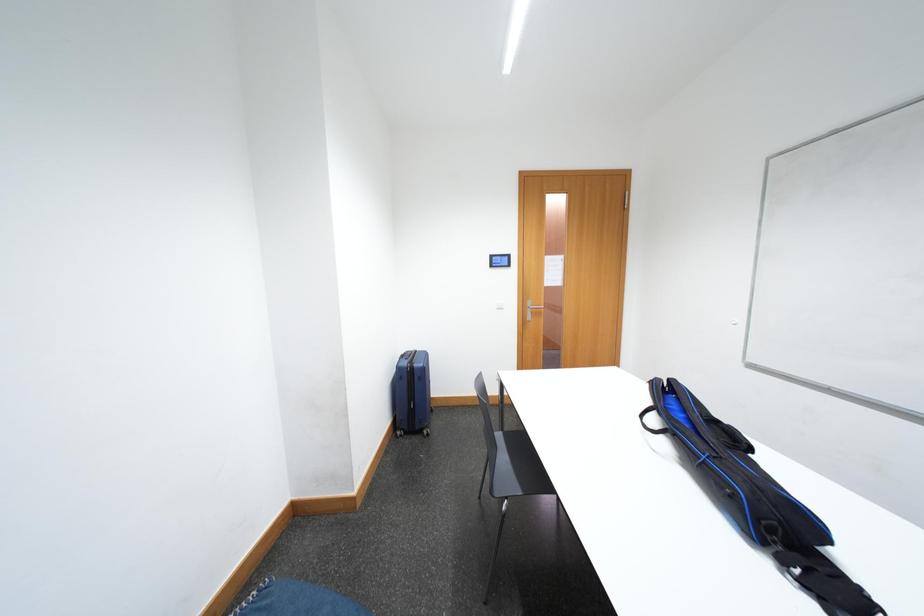
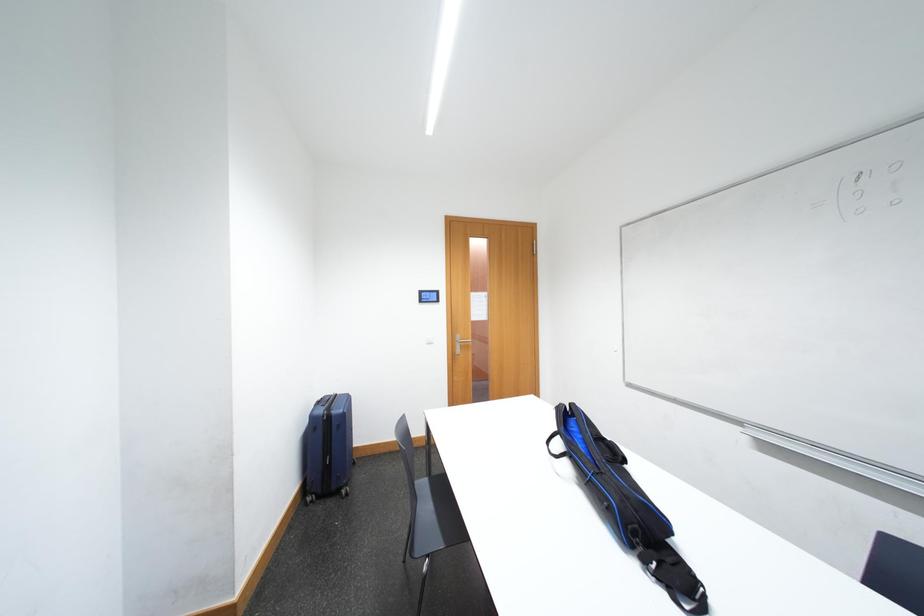
What movement of the cameraman would produce the second image?

The cameraman moved toward right, backward.